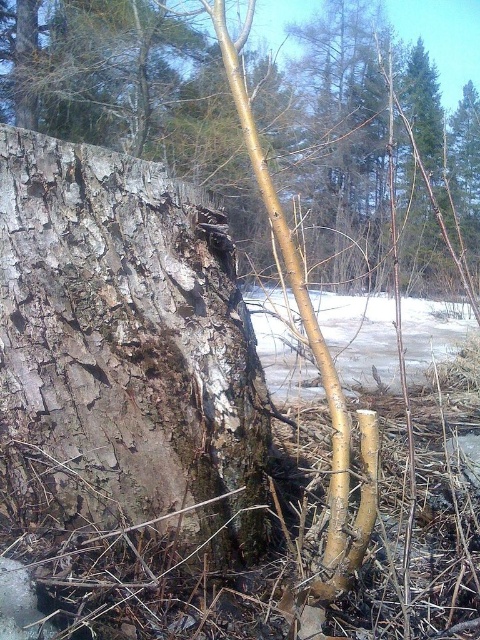
Question: Is grayish-brown bark at center wider than smooth bark tree trunk at center?

Choices:
 (A) yes
 (B) no

Answer: (B)

Question: From the image, what is the correct spatial relationship of grayish-brown bark at center in relation to smooth bark tree trunk at center?

Choices:
 (A) below
 (B) above

Answer: (A)

Question: Is grayish-brown bark at center behind smooth bark tree trunk at center?

Choices:
 (A) yes
 (B) no

Answer: (B)

Question: Which of the following is the farthest from the observer?

Choices:
 (A) grayish-brown bark at center
 (B) smooth bark tree trunk at center

Answer: (B)